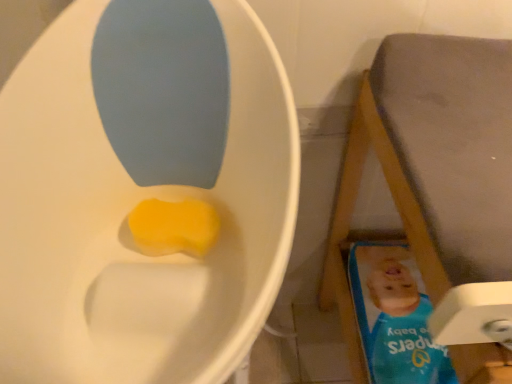
Image resolution: width=512 pixels, height=384 pixels. Describe the element at coordinates (174, 227) in the screenshot. I see `yellow sponge at lower center` at that location.

Where is `yellow sponge at lower center`? yellow sponge at lower center is located at coordinates (174, 227).

In order to face yellow sponge at lower center, should I rotate leftwards or rightwards?

It's best to rotate left around 11.392 degrees.

This screenshot has width=512, height=384. Find the location of `yellow sponge at lower center`. yellow sponge at lower center is located at coordinates (174, 227).